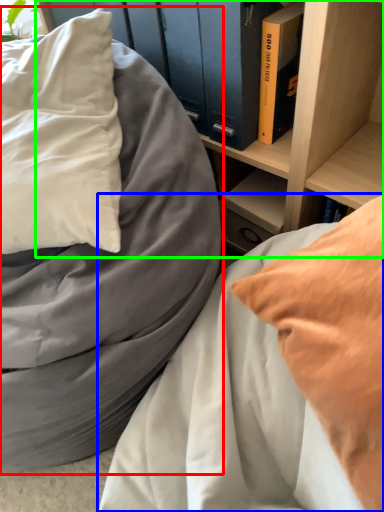
Question: Which object is the closest to the bed (highlighted by a red box)? Choose among these: bed (highlighted by a blue box) or shelf (highlighted by a green box).

Choices:
 (A) bed
 (B) shelf

Answer: (A)